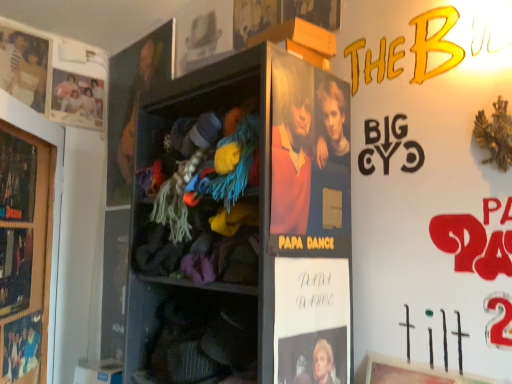
Question: Is matte paper poster at center, the 3th person viewed from the left, to the left or to the right of matte paper poster at upper left, the 3th movie poster from the top, in the image?

Choices:
 (A) right
 (B) left

Answer: (A)

Question: From the image's perspective, is matte paper poster at center, acting as the first person starting from the front, located above or below matte paper poster at upper left, acting as the 4th movie poster starting from the right?

Choices:
 (A) above
 (B) below

Answer: (B)

Question: Which object is positioned farthest from the matte cardboard movie poster at lower left, which is counted as the second movie poster, starting from the left?

Choices:
 (A) matte cardboard poster at upper center, which is the second movie poster in right-to-left order
 (B) matte black poster at left, which is counted as the 2th advertisement, starting from the right
 (C) wooden shelf at center
 (D) wooden framed poster at left, the third advertisement from the right
 (E) matte white family portrait at upper left, positioned as the first person in left-to-right order

Answer: (A)

Question: Which object is the closest to the wooden framed poster at left, the third advertisement from the right?

Choices:
 (A) matte cardboard poster at upper center, which is the second movie poster in right-to-left order
 (B) matte cardboard movie poster at lower left, the third movie poster from the right
 (C) matte paper movie poster at upper center, arranged as the 1th movie poster when viewed from the right
 (D) wooden shelf at center
 (E) matte black guitar at upper left, positioned as the 2th person in back-to-front order

Answer: (B)